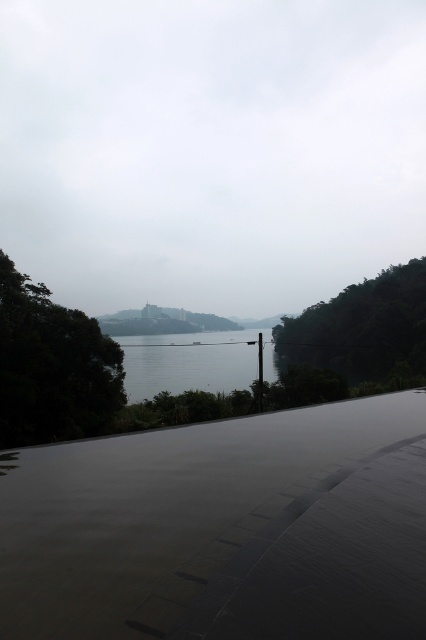
Question: Which object appears closest to the camera in this image?

Choices:
 (A) green leafy tree at left
 (B) green matte tree at right
 (C) clear water at center

Answer: (A)

Question: Is green leafy tree at left below clear water at center?

Choices:
 (A) yes
 (B) no

Answer: (B)

Question: Does green matte tree at right have a larger size compared to clear water at center?

Choices:
 (A) yes
 (B) no

Answer: (A)

Question: Does green leafy tree at left lie in front of smooth metallic pole at center?

Choices:
 (A) yes
 (B) no

Answer: (A)

Question: Among these objects, which one is farthest from the camera?

Choices:
 (A) smooth metallic pole at center
 (B) green leafy tree at left
 (C) green matte tree at right
 (D) clear water at center

Answer: (C)

Question: Which object is positioned closest to the green leafy tree at left?

Choices:
 (A) clear water at center
 (B) smooth metallic pole at center

Answer: (B)